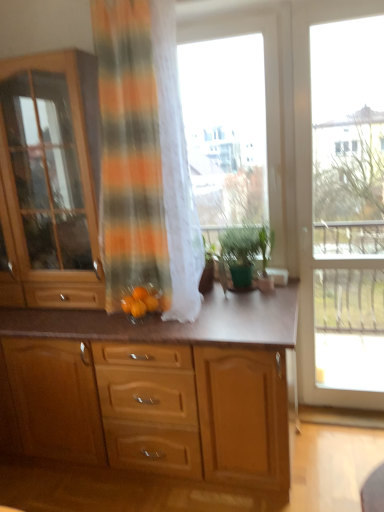
Where is `vacant area that lies to the right of orange matte tangerine at center, the second tangerine positioned from the left`? vacant area that lies to the right of orange matte tangerine at center, the second tangerine positioned from the left is located at coordinates (198, 311).